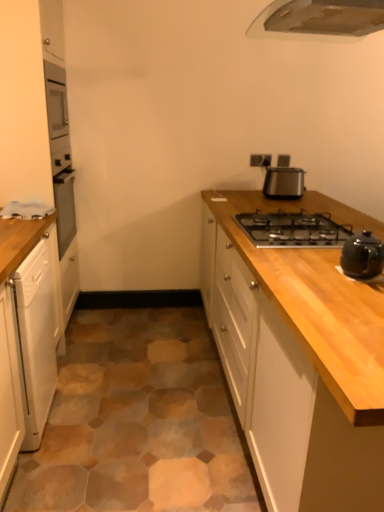
Question: From the image's perspective, relative to metallic stainless steel toaster at upper right, which is the 1th kitchen appliance from top to bottom, is white glossy dishwasher at left, the 3th cabinetry viewed from the right, above or below?

Choices:
 (A) below
 (B) above

Answer: (A)

Question: Is point (13, 114) positioned closer to the camera than point (271, 176)?

Choices:
 (A) farther
 (B) closer

Answer: (B)

Question: Considering the real-world distances, which object is closest to the black ceramic teapot at right, which is the 2th kitchen appliance from top to bottom?

Choices:
 (A) white glossy dishwasher at left, marked as the first cabinetry in a left-to-right arrangement
 (B) white glossy dishwasher at left, which ranks as the 2th cabinetry in right-to-left order
 (C) metallic stainless steel toaster at upper right, marked as the first kitchen appliance in a back-to-front arrangement
 (D) wooden cabinet at center, the 3th cabinetry from the left
 (E) metallic silver outlet at upper right

Answer: (D)

Question: Based on their relative distances, which object is nearer to the metallic silver outlet at upper right?

Choices:
 (A) black ceramic teapot at right, the 1th kitchen appliance from the bottom
 (B) white glossy dishwasher at left, the 3th cabinetry viewed from the right
 (C) black metallic gas stove at upper right
 (D) metallic stainless steel toaster at upper right, which is the 1th kitchen appliance from top to bottom
 (E) white glossy dishwasher at left, the 2th cabinetry in the left-to-right sequence

Answer: (D)